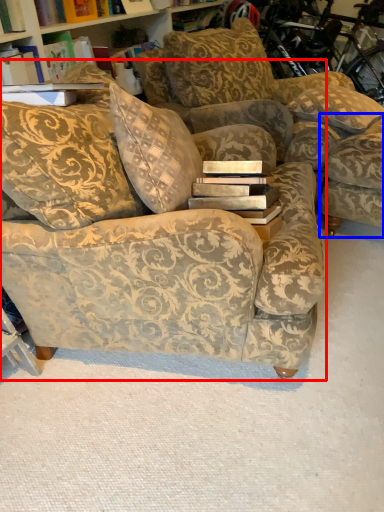
Question: Which point is closer to the camera, studio couch (highlighted by a red box) or swivel chair (highlighted by a blue box)?

Choices:
 (A) studio couch
 (B) swivel chair

Answer: (A)